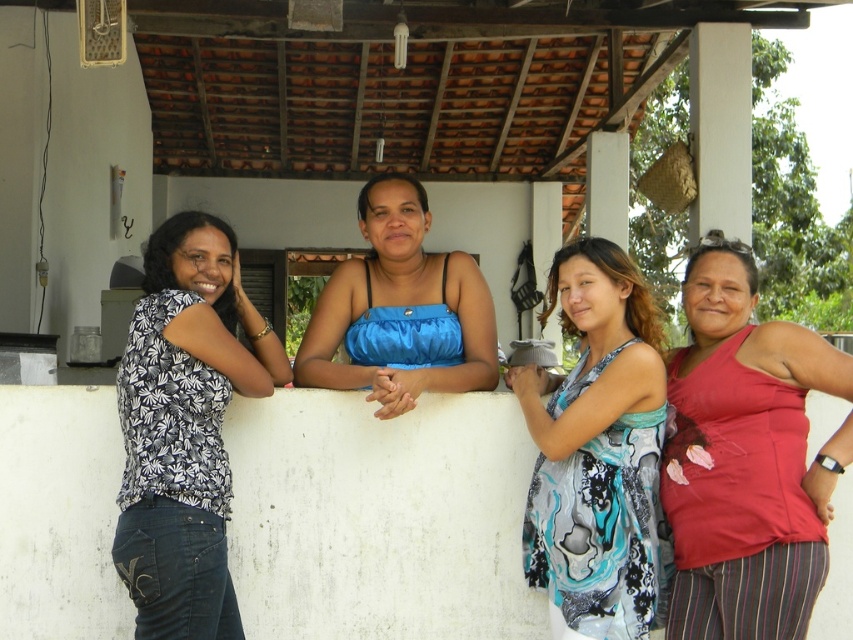
You are a photographer setting up for a group photo. You want to ensure that the printed silk dress at center and the blue satin top at center are both in focus. If your camera has a depth of field that can cover 70 centimeters, will both items be in focus?

The distance between the printed silk dress at center and the blue satin top at center is 69.26 centimeters, which is within the camera depth of field of 70 centimeters. Therefore, both items will be in focus.

Consider the image. You are a photographer trying to capture a photo of the two women wearing the matte red tank top at right and the blue satin top at center. Based on their positions, which woman should you focus on first to ensure both are in frame?

The matte red tank top at right is below the blue satin top at center, so you should focus on the blue satin top at center first to ensure both are in frame.